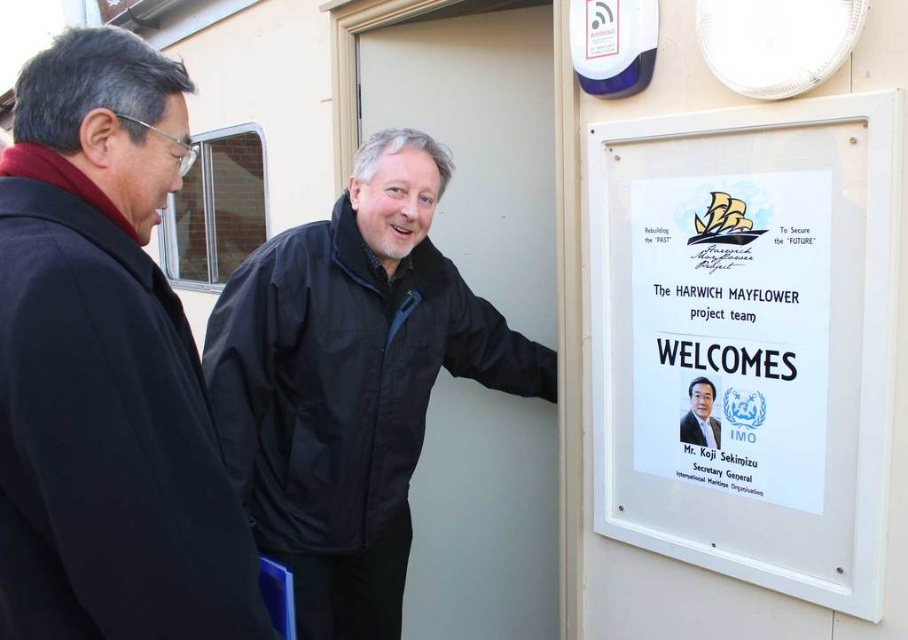
You are a tour guide explaining the signboard to visitors. You notice two points marked on the signboard. The first point is at coordinate point (37,461) and the second point is at coordinate point (272,468). Which point is closer to the visitors if they are standing directly in front of the signboard?

Point (37,461) is in front of point (272,468), so it is closer to the visitors standing directly in front of the signboard.

You are a delivery person who needs to attach a package to the white paper at center. The black matte jacket at center is in the way. Can you move the jacket to make space?

The black matte jacket at center is below the white paper at center, so you can move the jacket upwards to create space for attaching the package to the white paper at center.